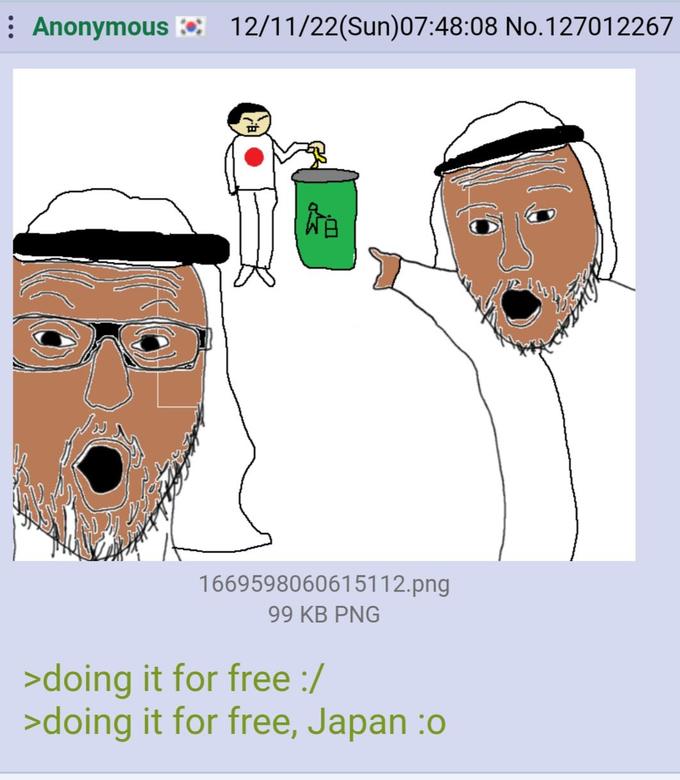
Identify the location of trash can. (340, 207).